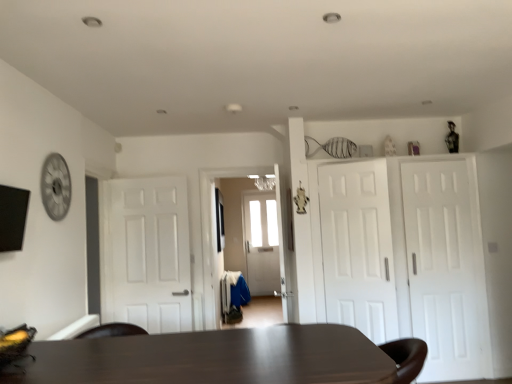
What is the approximate width of white matte door at right, positioned as the 4th door in left-to-right order?

It is 2.27 inches.

Describe the element at coordinates (147, 253) in the screenshot. Image resolution: width=512 pixels, height=384 pixels. I see `white matte door at center, the 4th door in the right-to-left sequence` at that location.

Locate an element on the screen. white matte door at center, arranged as the 1th door when viewed from the left is located at coordinates (147, 253).

You are a GUI agent. You are given a task and a screenshot of the screen. Output one action in this format:
    pyautogui.click(x=<x>, y=<y>)
    Task: Click on the white matte door at right, the 3th door in the left-to-right sequence
    
    Given the screenshot: What is the action you would take?
    pyautogui.click(x=404, y=256)

Can you see white matte door at center, arranged as the 1th door when viewed from the left, touching white matte door at center, acting as the 2th door starting from the left?

No, white matte door at center, arranged as the 1th door when viewed from the left, is not beside white matte door at center, acting as the 2th door starting from the left.

Could you tell me if white matte door at center, the 4th door in the right-to-left sequence, is turned towards white matte door at center, acting as the 2th door starting from the left?

No, white matte door at center, the 4th door in the right-to-left sequence, does not turn towards white matte door at center, acting as the 2th door starting from the left.

Does white matte door at center, the 4th door in the right-to-left sequence, appear on the left side of white matte door at center, acting as the 2th door starting from the left?

Correct, you'll find white matte door at center, the 4th door in the right-to-left sequence, to the left of white matte door at center, acting as the 2th door starting from the left.

From the image's perspective, who appears lower, white matte door at center, arranged as the 1th door when viewed from the left, or white matte door at center, which appears as the 3th door when viewed from the right?

white matte door at center, arranged as the 1th door when viewed from the left, from the image's perspective.

Which of these two, white matte door at center, arranged as the 1th door when viewed from the left, or white matte door at right, which is counted as the 1th door, starting from the right, is thinner?

white matte door at right, which is counted as the 1th door, starting from the right.

Does white matte door at center, the 4th door in the right-to-left sequence, come behind white matte door at right, positioned as the 4th door in left-to-right order?

Yes, it is behind white matte door at right, positioned as the 4th door in left-to-right order.

Can you confirm if white matte door at center, the 4th door in the right-to-left sequence, is positioned to the right of white matte door at right, which is counted as the 1th door, starting from the right?

In fact, white matte door at center, the 4th door in the right-to-left sequence, is to the left of white matte door at right, which is counted as the 1th door, starting from the right.

Does white matte door at center, the 4th door in the right-to-left sequence, touch white matte door at right, which is counted as the 1th door, starting from the right?

No, white matte door at center, the 4th door in the right-to-left sequence, is not beside white matte door at right, which is counted as the 1th door, starting from the right.

Can you confirm if white matte door at right, which is counted as the 1th door, starting from the right, is bigger than metallic silver clock at upper left?

Yes.

Which object is closer to the camera taking this photo, white matte door at right, which is counted as the 1th door, starting from the right, or metallic silver clock at upper left?

Positioned in front is metallic silver clock at upper left.

Is white matte door at right, which is counted as the 1th door, starting from the right, facing towards metallic silver clock at upper left?

No, white matte door at right, which is counted as the 1th door, starting from the right, is not turned towards metallic silver clock at upper left.

From a real-world perspective, is white matte door at right, positioned as the 4th door in left-to-right order, above or below metallic silver clock at upper left?

In terms of real-world spatial position, white matte door at right, positioned as the 4th door in left-to-right order, is below metallic silver clock at upper left.

Is white matte door at right, which is the 2th door in right-to-left order, spatially inside white matte door at right, positioned as the 4th door in left-to-right order, or outside of it?

white matte door at right, which is the 2th door in right-to-left order, is not inside white matte door at right, positioned as the 4th door in left-to-right order, it's outside.

In the scene shown: Is white matte door at right, which is the 2th door in right-to-left order, closer to camera compared to white matte door at right, which is counted as the 1th door, starting from the right?

Yes, white matte door at right, which is the 2th door in right-to-left order, is in front of white matte door at right, which is counted as the 1th door, starting from the right.

In terms of height, does white matte door at right, the 3th door in the left-to-right sequence, look taller or shorter compared to white matte door at right, which is counted as the 1th door, starting from the right?

Clearly, white matte door at right, the 3th door in the left-to-right sequence, is taller compared to white matte door at right, which is counted as the 1th door, starting from the right.

Which object is thinner, white matte door at right, the 3th door in the left-to-right sequence, or white matte door at right, which is counted as the 1th door, starting from the right?

white matte door at right, which is counted as the 1th door, starting from the right, is thinner.

Locate an element on the screen. This screenshot has width=512, height=384. table located in front of the white matte door at right, the 3th door in the left-to-right sequence is located at coordinates (212, 358).

From the image's perspective, between dark brown wooden table at center and white matte door at right, the 3th door in the left-to-right sequence, who is located below?

dark brown wooden table at center, from the image's perspective.

Can you confirm if dark brown wooden table at center is thinner than white matte door at right, the 3th door in the left-to-right sequence?

No, dark brown wooden table at center is not thinner than white matte door at right, the 3th door in the left-to-right sequence.

From a real-world perspective, which object rests below the other?

dark brown wooden table at center is physically lower.

From the image's perspective, is white matte door at right, positioned as the 4th door in left-to-right order, positioned above or below white matte door at right, which is the 2th door in right-to-left order?

Based on their image positions, white matte door at right, positioned as the 4th door in left-to-right order, is located beneath white matte door at right, which is the 2th door in right-to-left order.

Is white matte door at right, positioned as the 4th door in left-to-right order, at the left side of white matte door at right, the 3th door in the left-to-right sequence?

No.

Is white matte door at right, which is counted as the 1th door, starting from the right, touching white matte door at right, the 3th door in the left-to-right sequence?

No, white matte door at right, which is counted as the 1th door, starting from the right, is not with white matte door at right, the 3th door in the left-to-right sequence.

Between white matte door at right, positioned as the 4th door in left-to-right order, and white matte door at right, which is the 2th door in right-to-left order, which one is positioned behind?

white matte door at right, positioned as the 4th door in left-to-right order, is behind.

From the image's perspective, is white matte door at right, which is the 2th door in right-to-left order, located beneath dark brown wooden table at center?

Incorrect, from the image's perspective, white matte door at right, which is the 2th door in right-to-left order, is higher than dark brown wooden table at center.

Which of these two, white matte door at right, the 3th door in the left-to-right sequence, or dark brown wooden table at center, is wider?

dark brown wooden table at center.

How much distance is there between white matte door at right, which is the 2th door in right-to-left order, and dark brown wooden table at center?

white matte door at right, which is the 2th door in right-to-left order, is 1.91 meters away from dark brown wooden table at center.

This screenshot has width=512, height=384. What are the coordinates of `the 1st door to the right of the white matte door at center, arranged as the 1th door when viewed from the left, counting from the anchor's position` in the screenshot? It's located at (358, 248).

I want to click on the 2nd door below the white matte door at center, arranged as the 1th door when viewed from the left (from the image's perspective), so click(x=446, y=268).

Considering their positions, is metallic silver clock at upper left positioned further to dark brown wooden table at center than white matte door at center, the 4th door in the right-to-left sequence?

Among the two, white matte door at center, the 4th door in the right-to-left sequence, is located further to dark brown wooden table at center.

From the picture: Based on their spatial positions, is white matte door at right, which is the 2th door in right-to-left order, or metallic silver clock at upper left closer to dark brown wooden table at center?

Based on the image, metallic silver clock at upper left appears to be nearer to dark brown wooden table at center.

Considering their positions, is white matte door at right, the 3th door in the left-to-right sequence, positioned closer to dark brown wooden table at center than white matte door at right, positioned as the 4th door in left-to-right order?

white matte door at right, the 3th door in the left-to-right sequence, is positioned closer to the anchor dark brown wooden table at center.

Based on their spatial positions, is white matte door at center, which appears as the 3th door when viewed from the right, or white matte door at center, the 4th door in the right-to-left sequence, closer to metallic silver clock at upper left?

Among the two, white matte door at center, the 4th door in the right-to-left sequence, is located nearer to metallic silver clock at upper left.

Based on their spatial positions, is white matte door at right, positioned as the 4th door in left-to-right order, or white matte door at center, acting as the 2th door starting from the left, closer to white matte door at right, which is the 2th door in right-to-left order?

white matte door at right, positioned as the 4th door in left-to-right order.

When comparing their distances from dark brown wooden table at center, does white matte door at right, which is counted as the 1th door, starting from the right, or metallic silver clock at upper left seem closer?

The object closer to dark brown wooden table at center is metallic silver clock at upper left.

Looking at the image, which one is located closer to white matte door at right, the 3th door in the left-to-right sequence, white matte door at center, which appears as the 3th door when viewed from the right, or metallic silver clock at upper left?

Among the two, white matte door at center, which appears as the 3th door when viewed from the right, is located nearer to white matte door at right, the 3th door in the left-to-right sequence.

Based on their spatial positions, is metallic silver clock at upper left or white matte door at center, which appears as the 3th door when viewed from the right, further from white matte door at center, arranged as the 1th door when viewed from the left?

white matte door at center, which appears as the 3th door when viewed from the right, is further to white matte door at center, arranged as the 1th door when viewed from the left.

Locate an element on the screen. The width and height of the screenshot is (512, 384). door between white matte door at center, which appears as the 3th door when viewed from the right, and white matte door at right, positioned as the 4th door in left-to-right order, in the horizontal direction is located at coordinates (404, 256).

Find the location of `table between metallic silver clock at upper left and white matte door at right, the 3th door in the left-to-right sequence, in the horizontal direction`. table between metallic silver clock at upper left and white matte door at right, the 3th door in the left-to-right sequence, in the horizontal direction is located at coordinates (212, 358).

You are a GUI agent. You are given a task and a screenshot of the screen. Output one action in this format:
    pyautogui.click(x=<x>, y=<y>)
    Task: Click on the door between white matte door at center, arranged as the 1th door when viewed from the left, and white matte door at right, which is the 2th door in right-to-left order
    
    Given the screenshot: What is the action you would take?
    pyautogui.click(x=358, y=248)

The height and width of the screenshot is (384, 512). What are the coordinates of `table between metallic silver clock at upper left and white matte door at center, acting as the 2th door starting from the left, from left to right` in the screenshot? It's located at (212, 358).